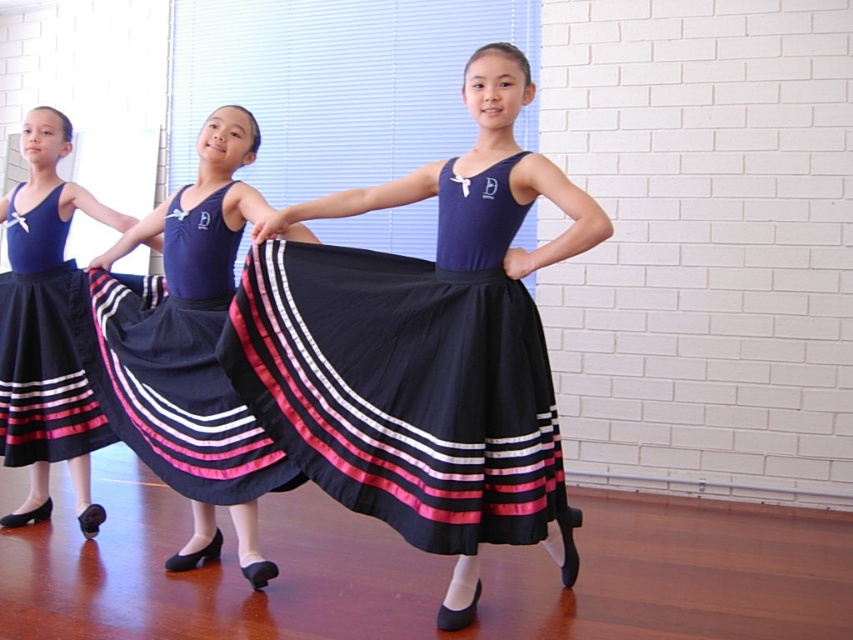
You are a costume designer preparing for a dance performance. You have two skirts to choose from in the image. The black satin skirt at center and the matte black skirt at left. Which skirt is wider?

The black satin skirt at center is wider than the matte black skirt at left.

You are a costume designer observing the three girls in the dance studio. You notice two skirts at the center of the image. Which skirt is taller, the black satin skirt at center or the navy satin skirt at center?

The black satin skirt at center has a greater height compared to the navy satin skirt at center.